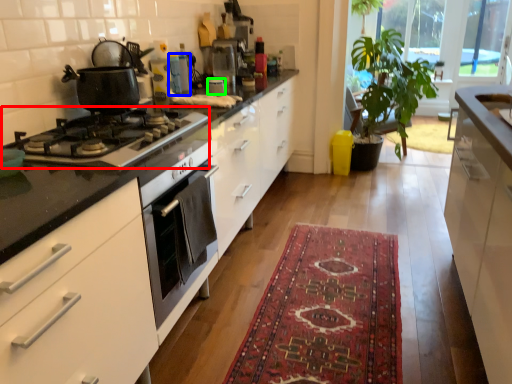
Question: Estimate the real-world distances between objects in this image. Which object is closer to gas stove (highlighted by a red box), appliance (highlighted by a blue box) or appliance (highlighted by a green box)?

Choices:
 (A) appliance
 (B) appliance

Answer: (A)